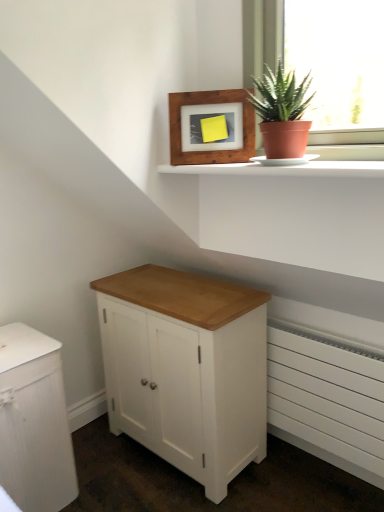
Where is `free region under white matte radiator at lower right (from a real-world perspective)`? The image size is (384, 512). free region under white matte radiator at lower right (from a real-world perspective) is located at coordinates (311, 468).